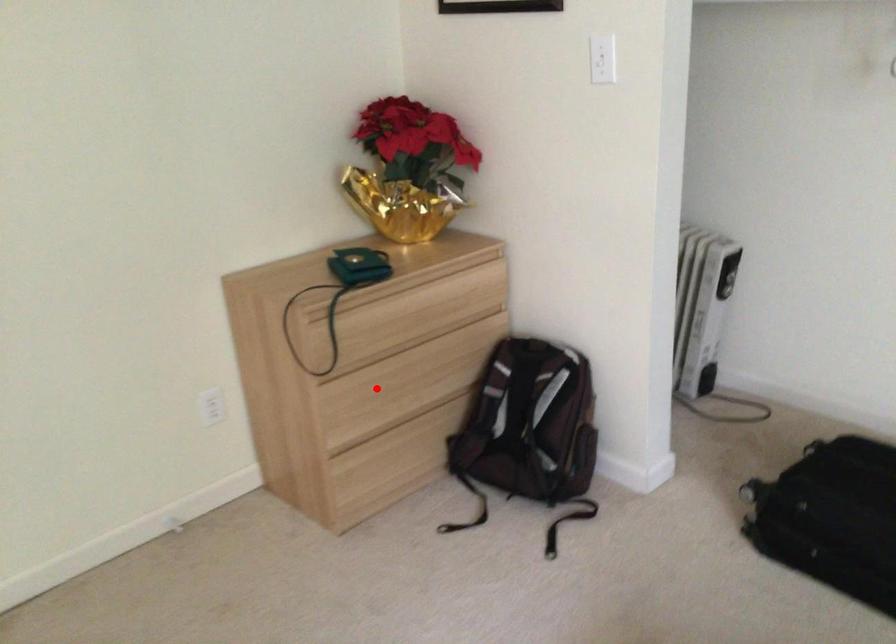
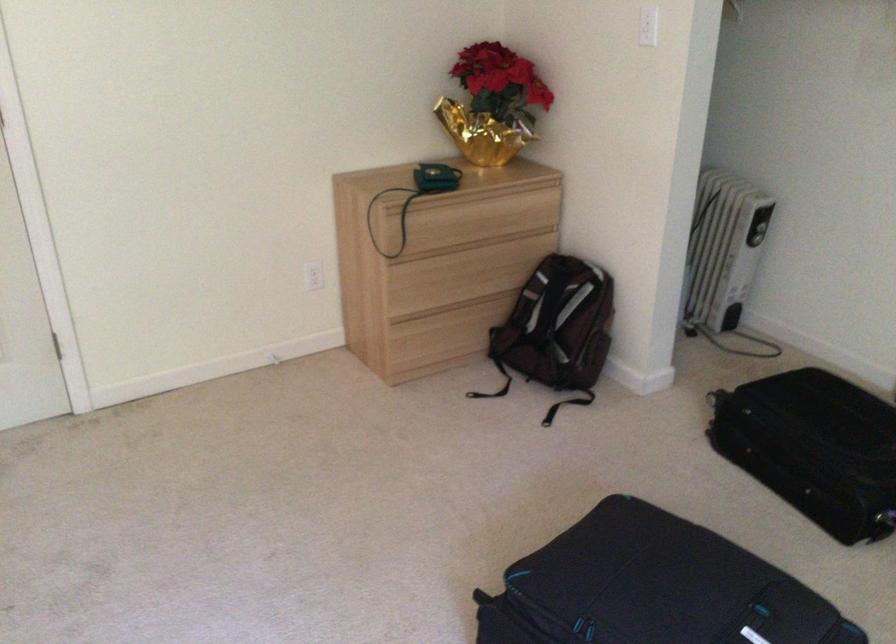
In the second image, find the point that corresponds to the highlighted location in the first image.

(435, 277)